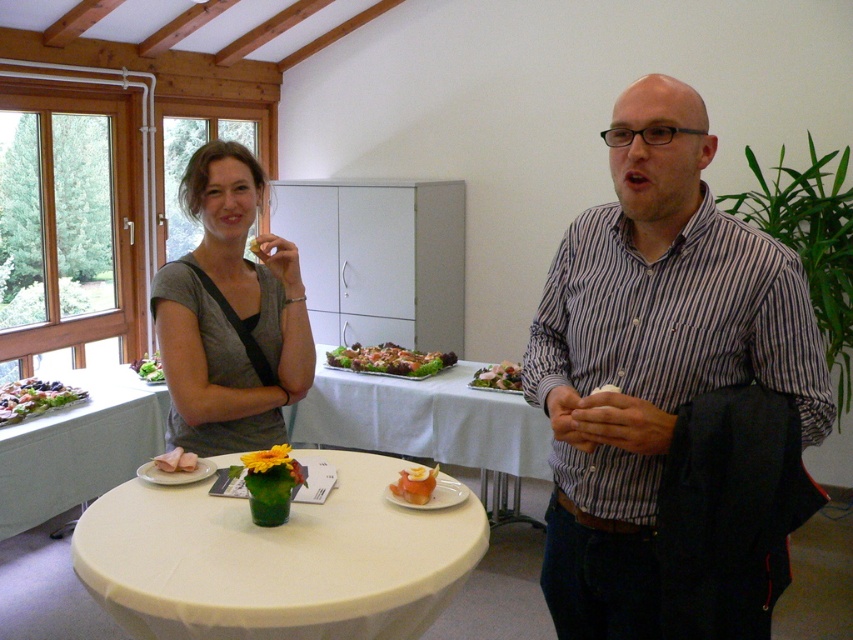
Between point (79, 394) and point (428, 477), which one is positioned in front?

Point (428, 477) is more forward.

Is point (21, 404) more distant than point (416, 481)?

Yes, it is behind point (416, 481).

Image resolution: width=853 pixels, height=640 pixels. Describe the element at coordinates (33, 397) in the screenshot. I see `blueberry-covered cake at left` at that location.

This screenshot has width=853, height=640. I want to click on blueberry-covered cake at left, so click(x=33, y=397).

Is point (378, 419) positioned behind point (10, 413)?

That is True.

What do you see at coordinates (432, 426) in the screenshot?
I see `white glossy plate at center` at bounding box center [432, 426].

What are the coordinates of `white glossy plate at center` in the screenshot? It's located at (432, 426).

Which is below, white cloth-covered table at center or white glossy plate at center?

white cloth-covered table at center

Is white cloth-covered table at center thinner than white glossy plate at center?

Yes.

Locate an element on the screen. The width and height of the screenshot is (853, 640). white cloth-covered table at center is located at coordinates (276, 560).